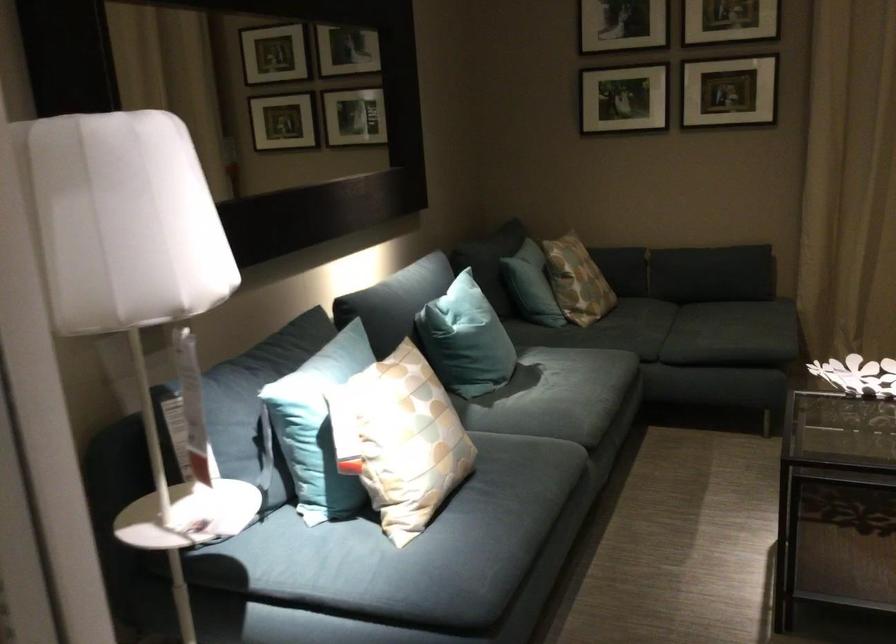
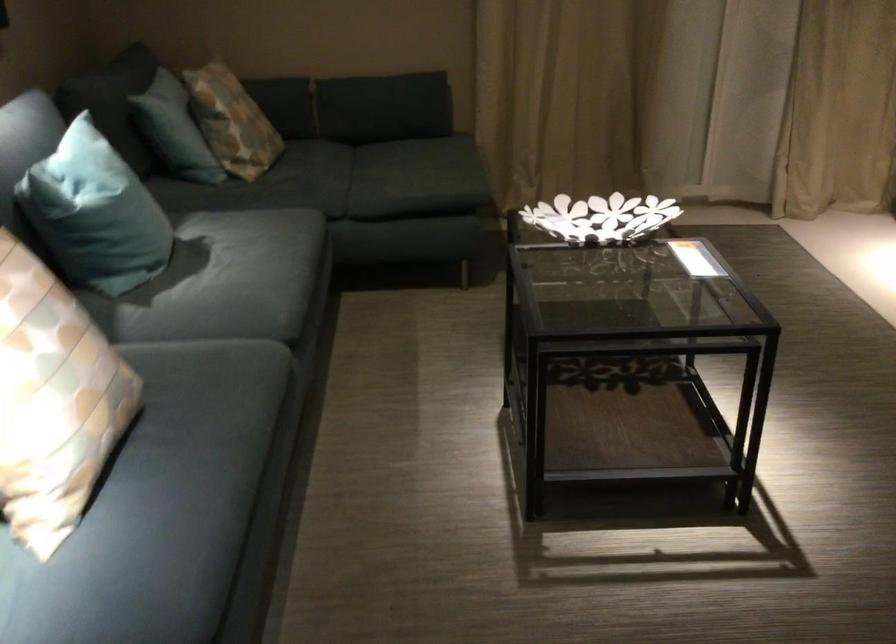
Locate, in the second image, the point that corresponds to point (530, 275) in the first image.

(174, 129)